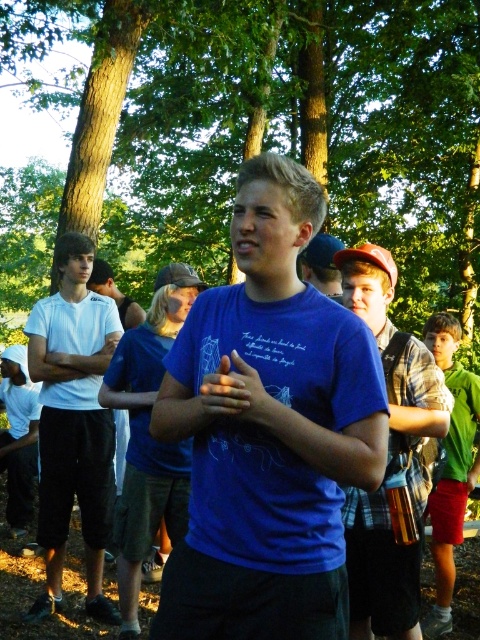
Who is more forward, (40, 294) or (186, 288)?

Point (186, 288) is more forward.

Between green leafy tree at center and blue cotton shirt at center, which one has less height?

Standing shorter between the two is blue cotton shirt at center.

Where is `green leafy tree at center`? Image resolution: width=480 pixels, height=640 pixels. green leafy tree at center is located at coordinates (253, 134).

Does blue cotton shirt at center come in front of green fabric shirt at center?

Yes, blue cotton shirt at center is closer to the viewer.

From the picture: Can you confirm if blue cotton shirt at center is positioned to the left of green fabric shirt at center?

Correct, you'll find blue cotton shirt at center to the left of green fabric shirt at center.

Does point (137, 624) come farther from viewer compared to point (448, 573)?

No, it is not.

Find the location of a particular element. blue cotton shirt at center is located at coordinates (148, 435).

Does blue matte shirt at center lie in front of white matte t-shirt at left?

Yes, it is.

Does point (203, 317) lie behind point (51, 589)?

No, (203, 317) is in front of (51, 589).

Is point (203, 518) positioned behind point (112, 458)?

That is False.

Find the location of a particular element. This screenshot has height=640, width=480. blue matte shirt at center is located at coordinates (268, 429).